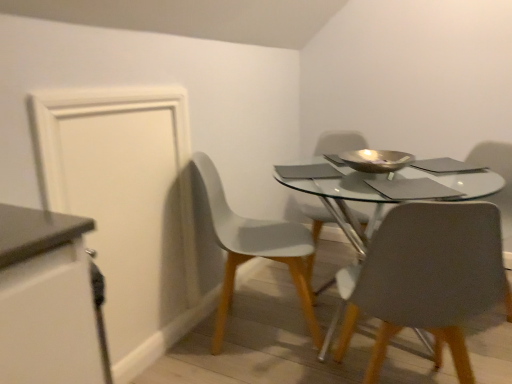
Question: Is matte gray chair at center, acting as the 3th chair starting from the back, not inside metallic gold bowl at center?

Choices:
 (A) no
 (B) yes

Answer: (B)

Question: From the image's perspective, is matte gray chair at center, acting as the 3th chair starting from the back, on metallic gold bowl at center?

Choices:
 (A) no
 (B) yes

Answer: (A)

Question: Is matte gray chair at center, the 1th chair viewed from the front, facing towards metallic gold bowl at center?

Choices:
 (A) yes
 (B) no

Answer: (A)

Question: From the image's perspective, is matte gray chair at center, acting as the 3th chair starting from the back, under metallic gold bowl at center?

Choices:
 (A) yes
 (B) no

Answer: (A)

Question: Is matte gray chair at center, acting as the 3th chair starting from the back, thinner than metallic gold bowl at center?

Choices:
 (A) yes
 (B) no

Answer: (B)

Question: Considering the relative sizes of matte gray chair at center, acting as the 3th chair starting from the back, and metallic gold bowl at center in the image provided, is matte gray chair at center, acting as the 3th chair starting from the back, smaller than metallic gold bowl at center?

Choices:
 (A) yes
 (B) no

Answer: (B)

Question: Does white matte cabinet at left turn towards matte gray chair at center, which is counted as the 1th chair, starting from the back?

Choices:
 (A) yes
 (B) no

Answer: (B)

Question: From the image's perspective, would you say white matte cabinet at left is shown under matte gray chair at center, marked as the 3th chair in a front-to-back arrangement?

Choices:
 (A) no
 (B) yes

Answer: (B)

Question: From the image's perspective, is white matte cabinet at left over matte gray chair at center, marked as the 3th chair in a front-to-back arrangement?

Choices:
 (A) no
 (B) yes

Answer: (A)

Question: Can you confirm if white matte cabinet at left is bigger than matte gray chair at center, marked as the 3th chair in a front-to-back arrangement?

Choices:
 (A) yes
 (B) no

Answer: (B)

Question: Considering the relative sizes of white matte cabinet at left and matte gray chair at center, marked as the 3th chair in a front-to-back arrangement, in the image provided, is white matte cabinet at left thinner than matte gray chair at center, marked as the 3th chair in a front-to-back arrangement,?

Choices:
 (A) no
 (B) yes

Answer: (B)

Question: Is white matte cabinet at left located outside matte gray chair at center, marked as the 3th chair in a front-to-back arrangement?

Choices:
 (A) no
 (B) yes

Answer: (B)

Question: From a real-world perspective, does metallic gold bowl at center stand above white matte chair at lower left, which appears as the second chair when viewed from the back?

Choices:
 (A) no
 (B) yes

Answer: (B)